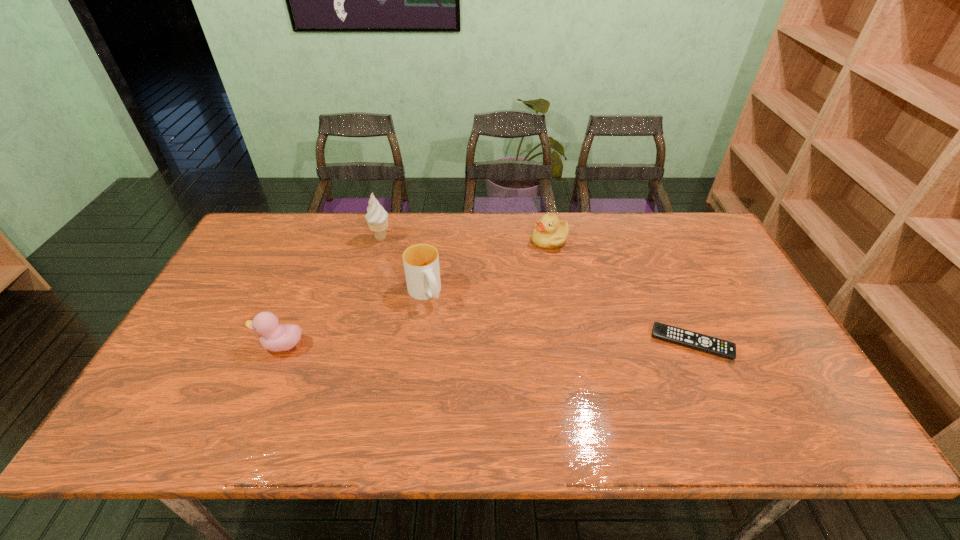
What are the coordinates of `vacant space located 0.110m on the front-facing side of the nearer duckling` in the screenshot? It's located at (214, 345).

The image size is (960, 540). Find the location of `free space located on the front-facing side of the nearer duckling`. free space located on the front-facing side of the nearer duckling is located at coordinates click(x=191, y=345).

Where is `free location located on the front-facing side of the nearer duckling`? The height and width of the screenshot is (540, 960). free location located on the front-facing side of the nearer duckling is located at coordinates (229, 345).

Locate an element on the screen. free space located 0.090m on the back of the remote control is located at coordinates (673, 302).

You are a GUI agent. You are given a task and a screenshot of the screen. Output one action in this format:
    pyautogui.click(x=<x>, y=<y>)
    Task: Click on the free point located 0.150m on the front-facing side of the fourth object from right to left
    Image resolution: width=960 pixels, height=540 pixels.
    Given the screenshot: What is the action you would take?
    pyautogui.click(x=409, y=268)

Identify the location of vacant position located on the front-facing side of the fourth object from right to left. This screenshot has height=540, width=960. (410, 270).

Locate an element on the screen. Image resolution: width=960 pixels, height=540 pixels. vacant space located 0.150m on the front-facing side of the fourth object from right to left is located at coordinates (409, 268).

Locate an element on the screen. vacant space located with the handle on the side of the cup is located at coordinates (471, 383).

Where is `free space located with the handle on the side of the cup`? The image size is (960, 540). free space located with the handle on the side of the cup is located at coordinates (458, 359).

I want to click on vacant space located 0.230m with the handle on the side of the cup, so click(465, 371).